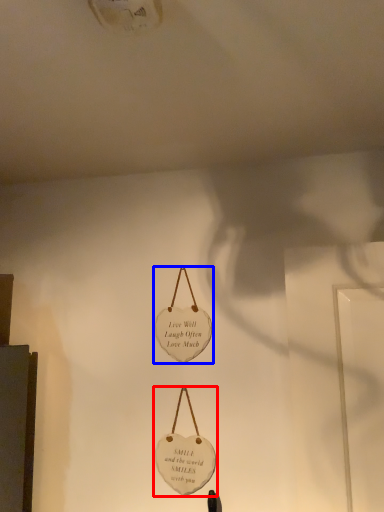
Question: Which object is further to the camera taking this photo, handbag (highlighted by a red box) or handbag (highlighted by a blue box)?

Choices:
 (A) handbag
 (B) handbag

Answer: (B)